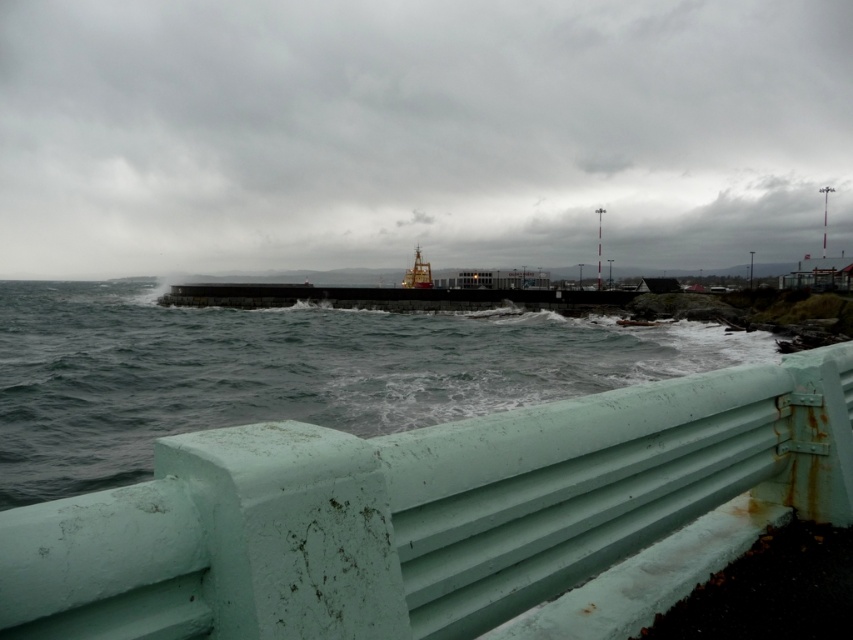
Is point (248, 401) positioned before point (419, 253)?

Yes, it is in front of point (419, 253).

Is gray matte water at center taller than gold metallic ship at center?

In fact, gray matte water at center may be shorter than gold metallic ship at center.

Where is `gray matte water at center`? This screenshot has height=640, width=853. gray matte water at center is located at coordinates (285, 371).

In the scene shown: Who is positioned more to the right, white painted metal barrier at lower center or gold metallic ship at center?

Positioned to the right is white painted metal barrier at lower center.

Locate an element on the screen. The height and width of the screenshot is (640, 853). white painted metal barrier at lower center is located at coordinates (419, 512).

Does point (799, 502) come behind point (428, 276)?

No, it is not.

Locate an element on the screen. white painted metal barrier at lower center is located at coordinates (419, 512).

The width and height of the screenshot is (853, 640). What do you see at coordinates (418, 132) in the screenshot?
I see `white matte water at lower center` at bounding box center [418, 132].

I want to click on white matte water at lower center, so [418, 132].